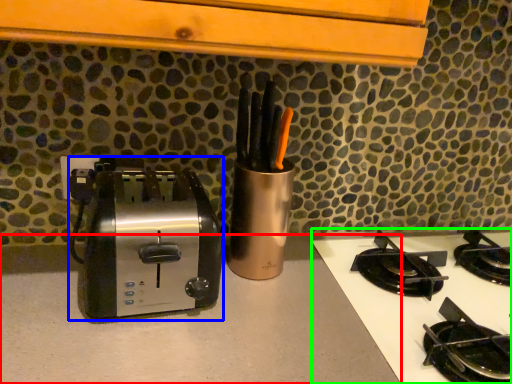
Question: Which object is the closest to the counter top (highlighted by a red box)? Choose among these: toaster (highlighted by a blue box) or gas stove (highlighted by a green box).

Choices:
 (A) toaster
 (B) gas stove

Answer: (A)